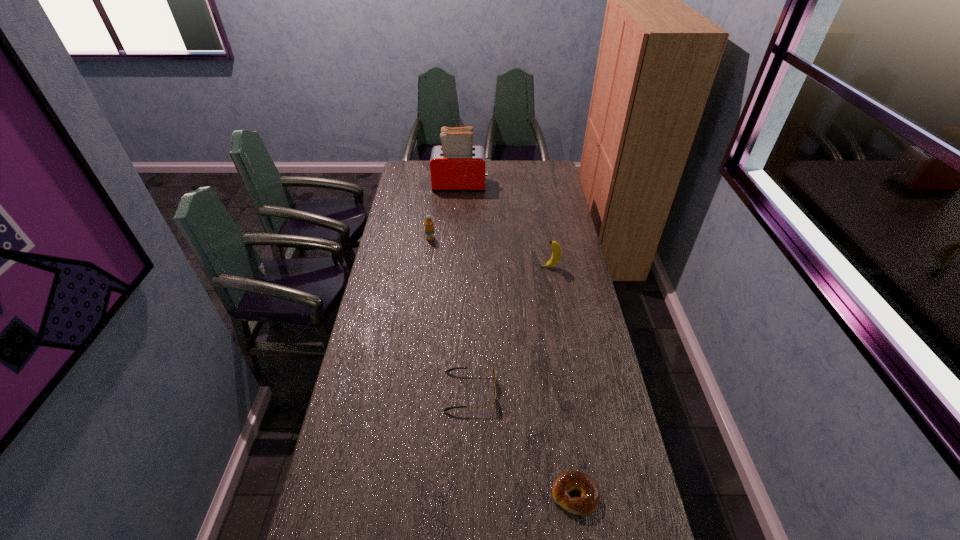
In the image, there is a desktop. At what (x,y) coordinates should I click in order to perform the action: click on vacant space at the left edge. Please return your answer as a coordinate pair (x, y). The height and width of the screenshot is (540, 960). Looking at the image, I should click on (416, 195).

Identify the location of vacant area at the right edge. This screenshot has height=540, width=960. (599, 426).

Image resolution: width=960 pixels, height=540 pixels. What are the coordinates of `free point between the farthest object and the banana` in the screenshot? It's located at (505, 226).

At what (x,y) coordinates should I click in order to perform the action: click on vacant space in between the shortest object and the third farthest object. Please return your answer as a coordinate pair (x, y). The image size is (960, 540). Looking at the image, I should click on (563, 381).

Image resolution: width=960 pixels, height=540 pixels. What are the coordinates of `free spot between the banana and the nearest object` in the screenshot? It's located at (563, 381).

The height and width of the screenshot is (540, 960). In order to click on vacant space that is in between the sunglasses and the farthest object in this screenshot , I will do `click(466, 288)`.

You are a GUI agent. You are given a task and a screenshot of the screen. Output one action in this format:
    pyautogui.click(x=<x>, y=<y>)
    Task: Click on the vacant point located between the bagel and the fourth nearest object
    The image size is (960, 540).
    Given the screenshot: What is the action you would take?
    pyautogui.click(x=503, y=367)

Where is `free space between the toaster and the orange juice`? The height and width of the screenshot is (540, 960). free space between the toaster and the orange juice is located at coordinates (445, 212).

Locate an element on the screen. object that stands as the third closest to the banana is located at coordinates (456, 165).

Select which object is the third closest to the tallest object. Please provide its 2D coordinates. Your answer should be formatted as a tuple, i.e. [(x, y)], where the tuple contains the x and y coordinates of a point satisfying the conditions above.

[(451, 369)]